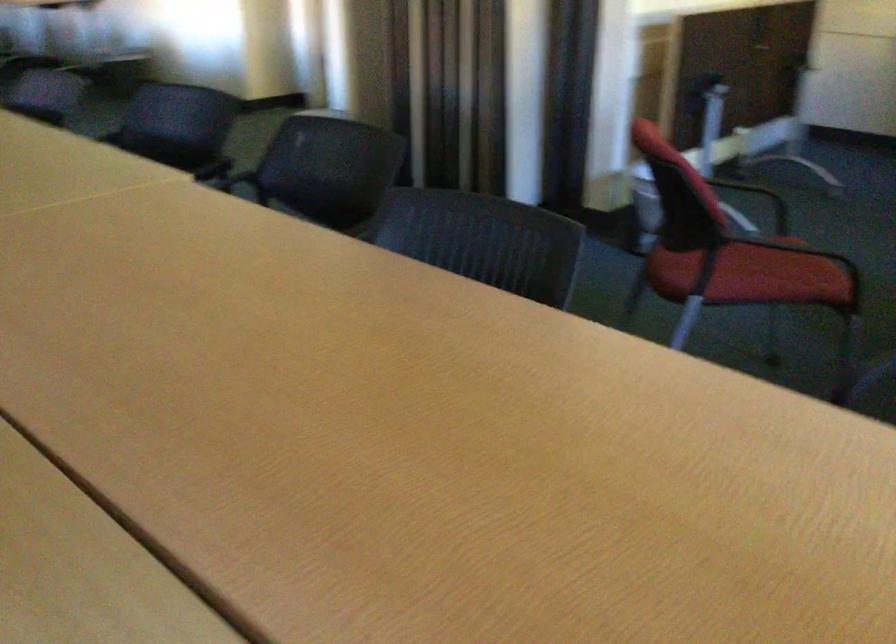
In order to click on black chair armrest in this screenshot , I will do `click(229, 178)`.